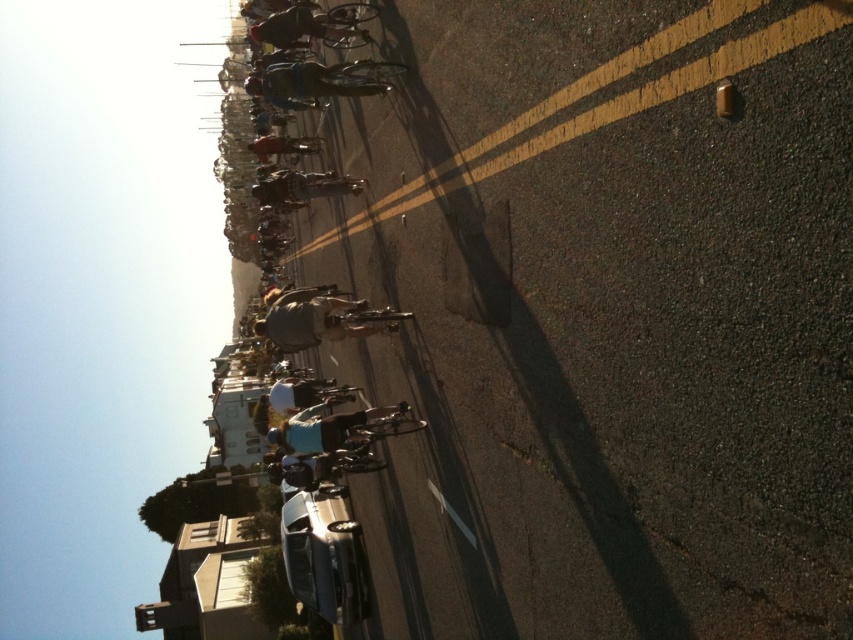
You are a delivery driver who needs to park your metallic silver car at center on the yellow asphalt road at center. Can you fit your car on the road without overlapping the road edges?

The yellow asphalt road at center is larger in size than the metallic silver car at center, so yes, the metallic silver car at center can fit on the yellow asphalt road at center without overlapping the road edges.

You are a drone operator who needs to capture a closeup of the yellow asphalt road at center. According to the coordinates provided, where should you position the drone to get the best shot?

The yellow asphalt road at center is located at point (601, 104). Position the drone at that coordinate for the best closeup shot.

What object is located at the point with coordinates (601, 104) in the image?

The point with coordinates (601, 104) corresponds to the yellow asphalt road at center.